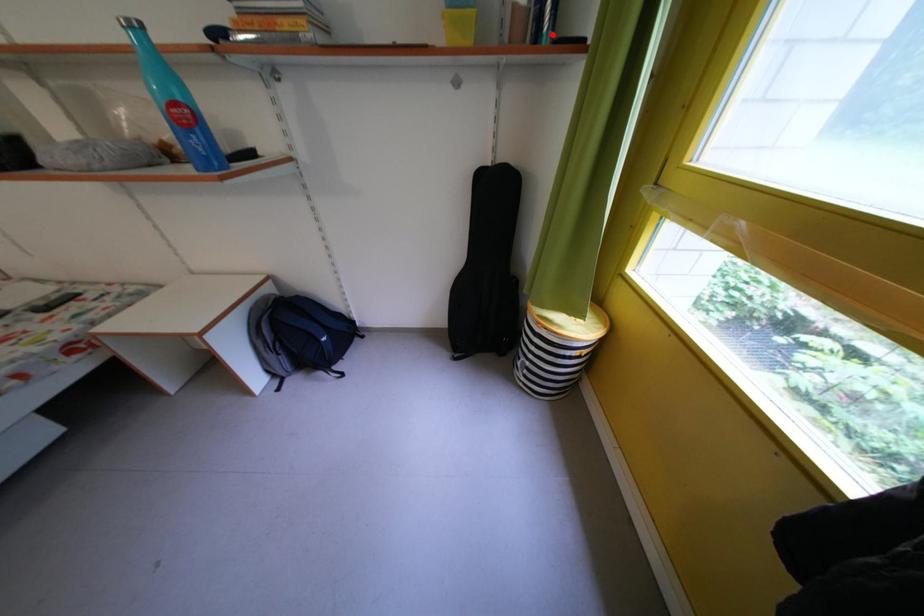
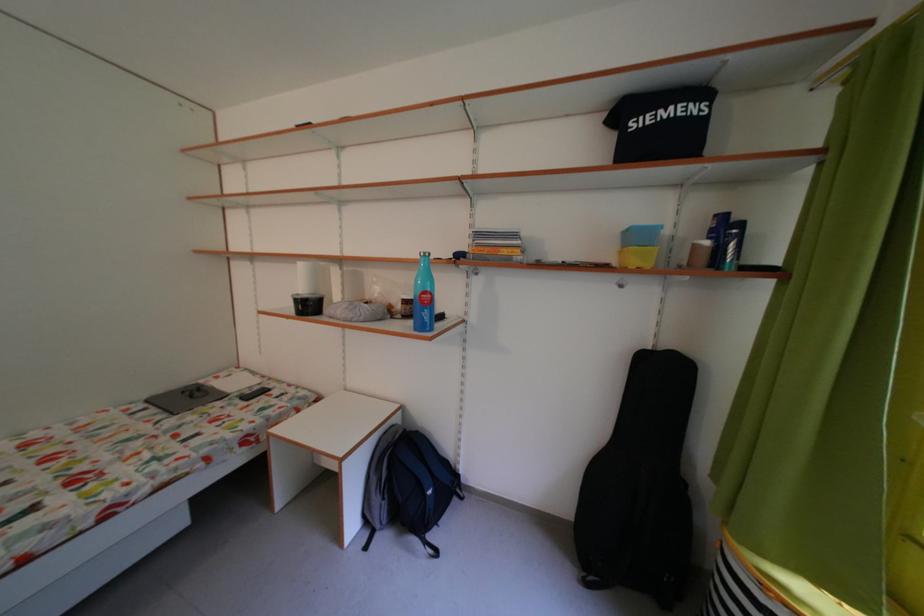
Find the pixel in the second image that matches the highlighted location in the first image.

(736, 265)